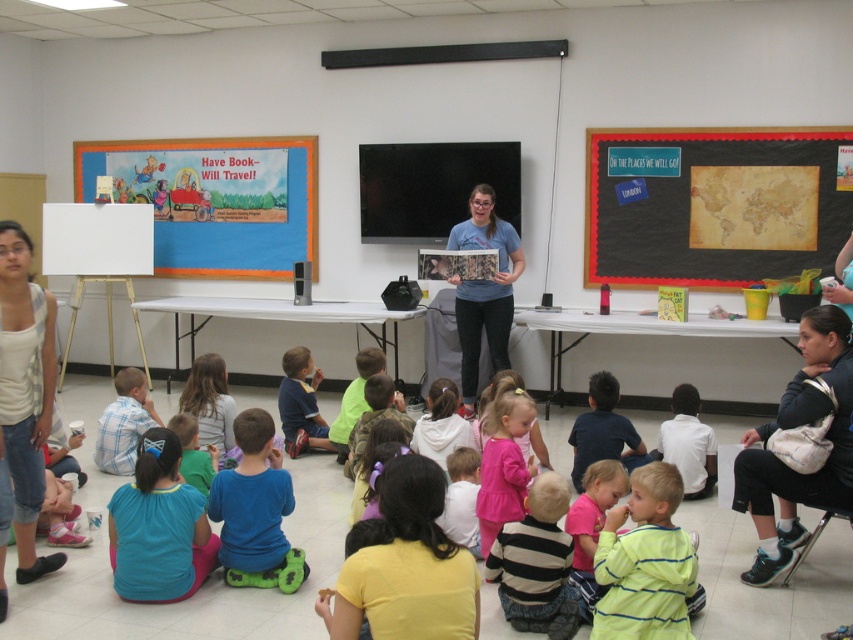
Locate an element on the screen. blue fabric shirt at center is located at coordinates (254, 509).

Can you confirm if blue fabric shirt at center is taller than dark blue shirt at center?

Yes.

Measure the distance between point (212, 500) and camera.

12.85 feet

At what (x,y) coordinates should I click in order to perform the action: click on blue fabric shirt at center. Please return your answer as a coordinate pair (x, y). This screenshot has width=853, height=640. Looking at the image, I should click on (254, 509).

Measure the distance between point (45, 432) and camera.

Point (45, 432) and camera are 3.72 meters apart.

This screenshot has height=640, width=853. What do you see at coordinates (22, 404) in the screenshot? I see `white tank top at left` at bounding box center [22, 404].

Find the location of a particular element. Image resolution: width=853 pixels, height=640 pixels. white tank top at left is located at coordinates (22, 404).

Does white cotton shirt at lower center have a larger size compared to blue cotton shirt at center?

No.

Can you confirm if white cotton shirt at lower center is positioned to the left of blue cotton shirt at center?

No, white cotton shirt at lower center is not to the left of blue cotton shirt at center.

What are the coordinates of `white cotton shirt at lower center` in the screenshot? It's located at (688, 444).